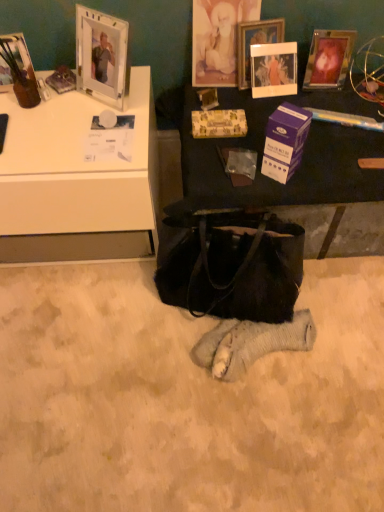
The height and width of the screenshot is (512, 384). In order to click on vacant space to the right of black leather handbag at center in this screenshot , I will do pos(343,310).